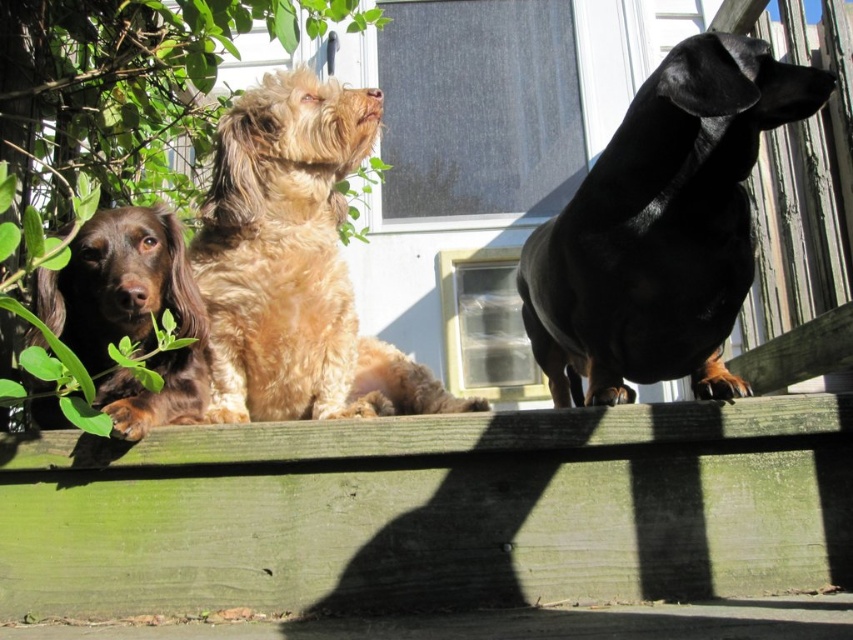
Question: Which point is closer to the camera?

Choices:
 (A) pos(611,141)
 (B) pos(334,260)
 (C) pos(134,429)
 (D) pos(456,472)

Answer: (C)

Question: Is green wood at center to the right of black shiny dachshund at upper right from the viewer's perspective?

Choices:
 (A) no
 (B) yes

Answer: (A)

Question: Which object is closer to the camera taking this photo?

Choices:
 (A) green wood at center
 (B) brown furry dog at left
 (C) fuzzy brown dog at center

Answer: (B)

Question: Is green wood at center to the right of brown furry dog at left from the viewer's perspective?

Choices:
 (A) yes
 (B) no

Answer: (A)

Question: Considering the real-world distances, which object is closest to the black shiny dachshund at upper right?

Choices:
 (A) brown furry dog at left
 (B) fuzzy brown dog at center

Answer: (B)

Question: Can you confirm if black shiny dachshund at upper right is wider than fuzzy brown dog at center?

Choices:
 (A) no
 (B) yes

Answer: (A)